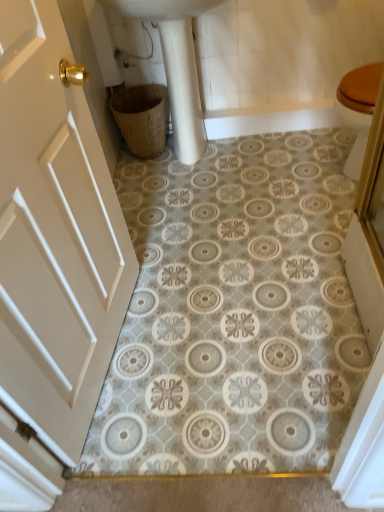
Question: Is white matte door at left smaller than white glossy sink at upper center?

Choices:
 (A) no
 (B) yes

Answer: (B)

Question: Does white matte door at left have a larger size compared to white glossy sink at upper center?

Choices:
 (A) no
 (B) yes

Answer: (A)

Question: Is white matte door at left positioned in front of white glossy sink at upper center?

Choices:
 (A) yes
 (B) no

Answer: (A)

Question: Does white matte door at left have a greater height compared to white glossy sink at upper center?

Choices:
 (A) no
 (B) yes

Answer: (B)

Question: From the image's perspective, would you say white matte door at left is positioned over white glossy sink at upper center?

Choices:
 (A) no
 (B) yes

Answer: (A)

Question: In terms of height, does white glossy sink at upper center look taller or shorter compared to woven brown basket at lower left?

Choices:
 (A) short
 (B) tall

Answer: (B)

Question: Considering the positions of white glossy sink at upper center and woven brown basket at lower left in the image, is white glossy sink at upper center bigger or smaller than woven brown basket at lower left?

Choices:
 (A) big
 (B) small

Answer: (A)

Question: Relative to woven brown basket at lower left, is white glossy sink at upper center in front or behind?

Choices:
 (A) front
 (B) behind

Answer: (A)

Question: Would you say white glossy sink at upper center is to the left or to the right of woven brown basket at lower left in the picture?

Choices:
 (A) left
 (B) right

Answer: (B)

Question: Is point (157, 100) closer or farther from the camera than point (203, 135)?

Choices:
 (A) closer
 (B) farther

Answer: (A)

Question: Considering the relative positions of woven brown basket at lower left and white glossy sink at upper center in the image provided, is woven brown basket at lower left to the left or to the right of white glossy sink at upper center?

Choices:
 (A) left
 (B) right

Answer: (A)

Question: Considering the positions of woven brown basket at lower left and white glossy sink at upper center in the image, is woven brown basket at lower left taller or shorter than white glossy sink at upper center?

Choices:
 (A) short
 (B) tall

Answer: (A)

Question: In the image, is woven brown basket at lower left positioned in front of or behind white glossy sink at upper center?

Choices:
 (A) behind
 (B) front

Answer: (A)

Question: Is woven brown basket at lower left taller or shorter than white matte door at left?

Choices:
 (A) short
 (B) tall

Answer: (A)

Question: Would you say woven brown basket at lower left is to the left or to the right of white matte door at left in the picture?

Choices:
 (A) left
 (B) right

Answer: (B)